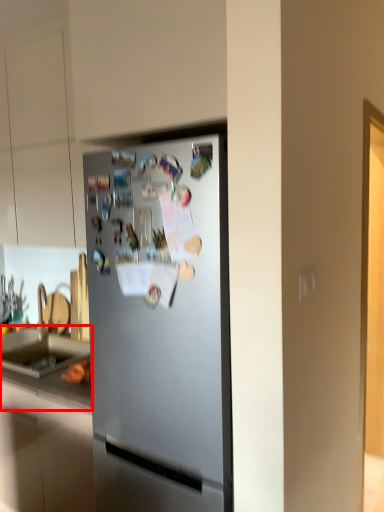
Question: From the image's perspective, what is the correct spatial relationship of counter top (annotated by the red box) in relation to refrigerator?

Choices:
 (A) above
 (B) below

Answer: (B)